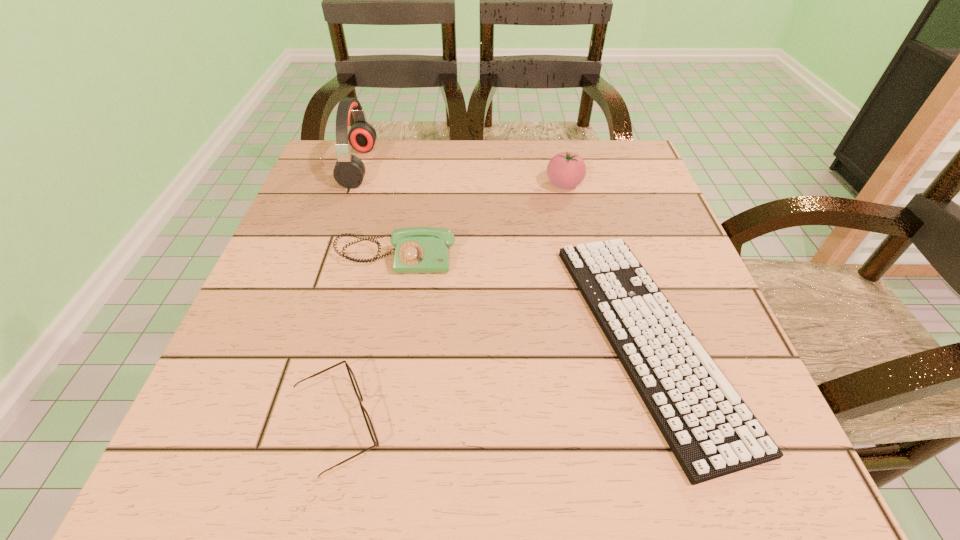
Where is `earphone`? The height and width of the screenshot is (540, 960). earphone is located at coordinates (349, 170).

I want to click on the fourth shortest object, so click(565, 170).

The height and width of the screenshot is (540, 960). Find the location of `telephone`. telephone is located at coordinates (417, 249).

This screenshot has width=960, height=540. I want to click on the fourth tallest object, so click(x=369, y=424).

Where is `the shortest object`? The width and height of the screenshot is (960, 540). the shortest object is located at coordinates (711, 431).

This screenshot has height=540, width=960. I want to click on vacant space located 0.270m on the ear cups of the earphone, so click(481, 166).

Where is `vacant space situated 0.120m on the left of the second tallest object`? vacant space situated 0.120m on the left of the second tallest object is located at coordinates (494, 184).

Identify the location of blank area located on the dial of the third shortest object. (351, 485).

Where is `free point located 0.230m with the lenses facing outward on the second shortest object`? The width and height of the screenshot is (960, 540). free point located 0.230m with the lenses facing outward on the second shortest object is located at coordinates (545, 425).

Find the location of `vacant space located 0.160m on the left of the computer keyboard`. vacant space located 0.160m on the left of the computer keyboard is located at coordinates (478, 337).